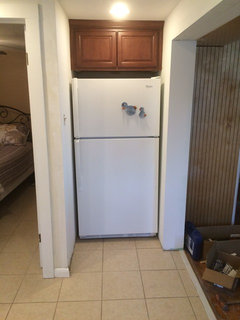
At what (x,y) coordinates should I click in order to perform the action: click on refrigerator. Please return your answer as a coordinate pair (x, y). The image size is (240, 320). Looking at the image, I should click on (105, 154).